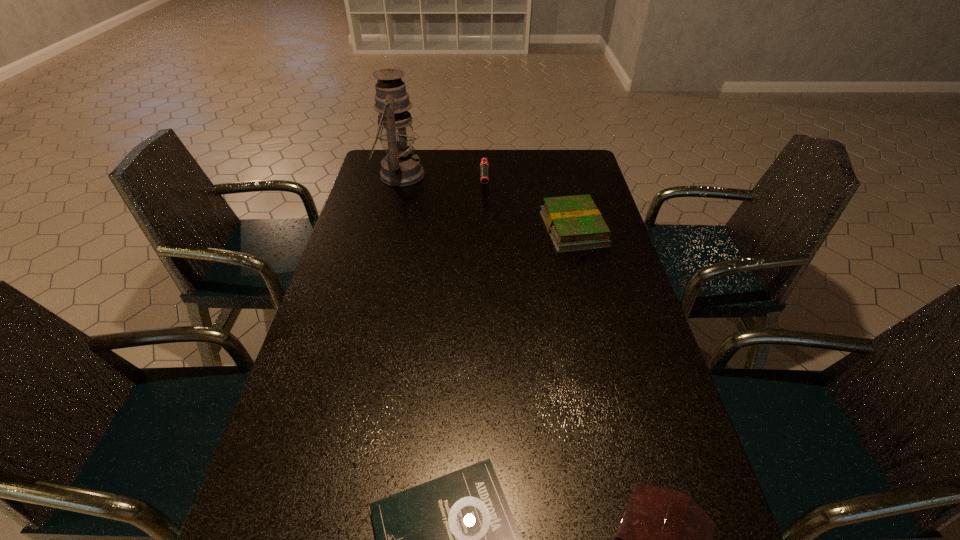
Find the location of a particular element. The height and width of the screenshot is (540, 960). oil lamp is located at coordinates (401, 167).

At what (x,y) coordinates should I click in order to perform the action: click on the leftmost object. Please return your answer as a coordinate pair (x, y). Image resolution: width=960 pixels, height=540 pixels. Looking at the image, I should click on (401, 167).

Identify the location of gun. Image resolution: width=960 pixels, height=540 pixels. point(484,165).

You are a GUI agent. You are given a task and a screenshot of the screen. Output one action in this format:
    pyautogui.click(x=<x>, y=<y>)
    Task: Click on the farthest book
    This screenshot has height=540, width=960.
    Given the screenshot: What is the action you would take?
    pyautogui.click(x=574, y=223)

Image resolution: width=960 pixels, height=540 pixels. I want to click on free spot located on the right of the leftmost object, so click(463, 174).

Where is `blank space located at the aiming end of the fourth shortest object`? This screenshot has height=540, width=960. blank space located at the aiming end of the fourth shortest object is located at coordinates (485, 231).

Where is `free location located 0.280m on the left of the farthest book`? This screenshot has width=960, height=540. free location located 0.280m on the left of the farthest book is located at coordinates (457, 229).

This screenshot has height=540, width=960. I want to click on oil lamp located in the far edge section of the desktop, so click(401, 167).

The image size is (960, 540). Find the location of `gun present at the far edge`. gun present at the far edge is located at coordinates (484, 165).

At what (x,y) coordinates should I click in order to perform the action: click on object that is at the left edge. Please return your answer as a coordinate pair (x, y). The width and height of the screenshot is (960, 540). Looking at the image, I should click on (401, 167).